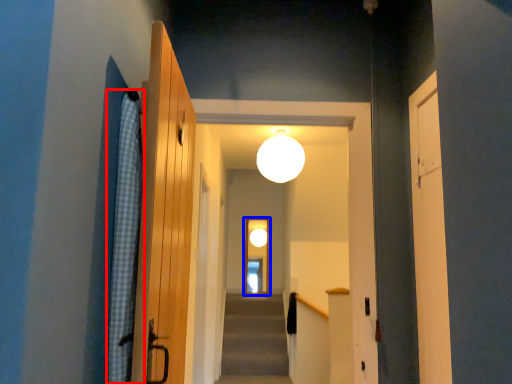
Question: Which object appears farthest to the camera in this image, curtain (highlighted by a red box) or screen door (highlighted by a blue box)?

Choices:
 (A) curtain
 (B) screen door

Answer: (B)